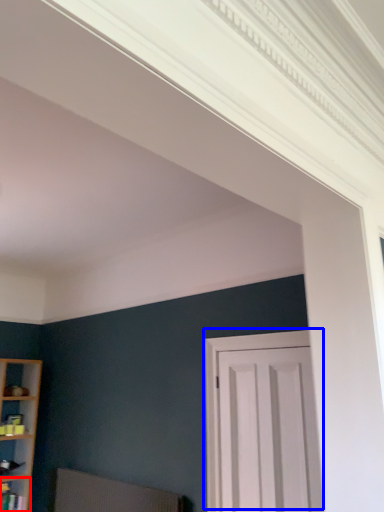
Question: Which object appears closest to the camera in this image, shelf (highlighted by a red box) or door (highlighted by a blue box)?

Choices:
 (A) shelf
 (B) door

Answer: (B)